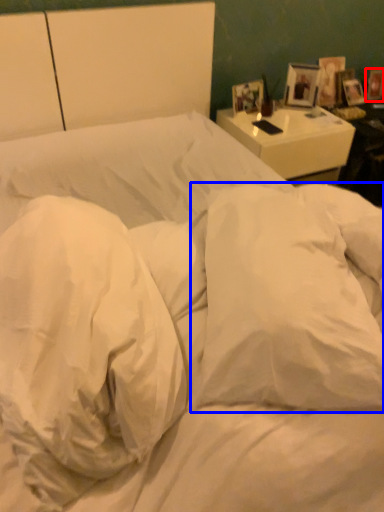
Question: Which of the following is the closest to the observer, picture frame (highlighted by a red box) or pillow (highlighted by a blue box)?

Choices:
 (A) picture frame
 (B) pillow

Answer: (B)